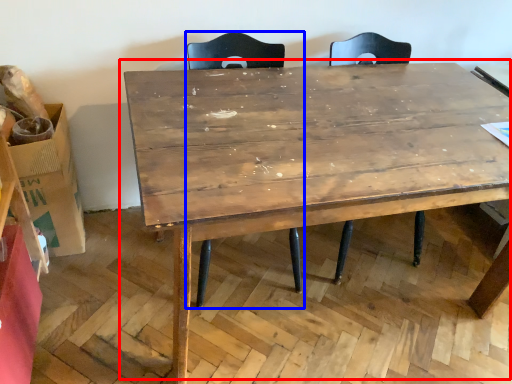
Question: Which object is further to the camera taking this photo, table (highlighted by a red box) or swivel chair (highlighted by a blue box)?

Choices:
 (A) table
 (B) swivel chair

Answer: (B)